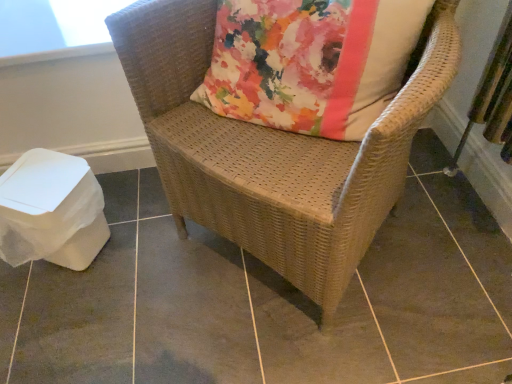
Question: From a real-world perspective, is transparent plastic window screen at upper left physically below brown woven chair at center?

Choices:
 (A) yes
 (B) no

Answer: (B)

Question: Is transparent plastic window screen at upper left shorter than brown woven chair at center?

Choices:
 (A) yes
 (B) no

Answer: (A)

Question: From the image's perspective, is transparent plastic window screen at upper left located beneath brown woven chair at center?

Choices:
 (A) no
 (B) yes

Answer: (A)

Question: From the image's perspective, is transparent plastic window screen at upper left located above brown woven chair at center?

Choices:
 (A) yes
 (B) no

Answer: (A)

Question: Is transparent plastic window screen at upper left surrounding brown woven chair at center?

Choices:
 (A) yes
 (B) no

Answer: (B)

Question: Is transparent plastic window screen at upper left at the left side of brown woven chair at center?

Choices:
 (A) yes
 (B) no

Answer: (A)

Question: From the image's perspective, is woven wicker chair at center located beneath transparent plastic window screen at upper left?

Choices:
 (A) no
 (B) yes

Answer: (B)

Question: Considering the relative sizes of woven wicker chair at center and transparent plastic window screen at upper left in the image provided, is woven wicker chair at center shorter than transparent plastic window screen at upper left?

Choices:
 (A) no
 (B) yes

Answer: (A)

Question: Is woven wicker chair at center further to the viewer compared to transparent plastic window screen at upper left?

Choices:
 (A) yes
 (B) no

Answer: (B)

Question: Are woven wicker chair at center and transparent plastic window screen at upper left far apart?

Choices:
 (A) no
 (B) yes

Answer: (A)

Question: Can you confirm if woven wicker chair at center is taller than transparent plastic window screen at upper left?

Choices:
 (A) no
 (B) yes

Answer: (B)

Question: Considering the relative sizes of woven wicker chair at center and transparent plastic window screen at upper left in the image provided, is woven wicker chair at center wider than transparent plastic window screen at upper left?

Choices:
 (A) no
 (B) yes

Answer: (B)

Question: Can you confirm if woven wicker chair at center is positioned to the left of brown woven chair at center?

Choices:
 (A) no
 (B) yes

Answer: (A)